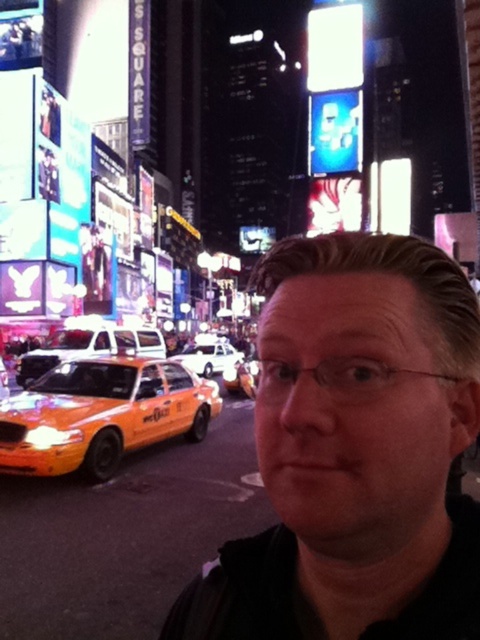
You are a photographer trying to capture a clear shot of the black matte man at center and the white glossy sedan at center in the bustling Times Square scene. Considering their sizes, which one would appear larger in your photo?

The black matte man at center appears larger in the photo because it has a greater height compared to the white glossy sedan at center.